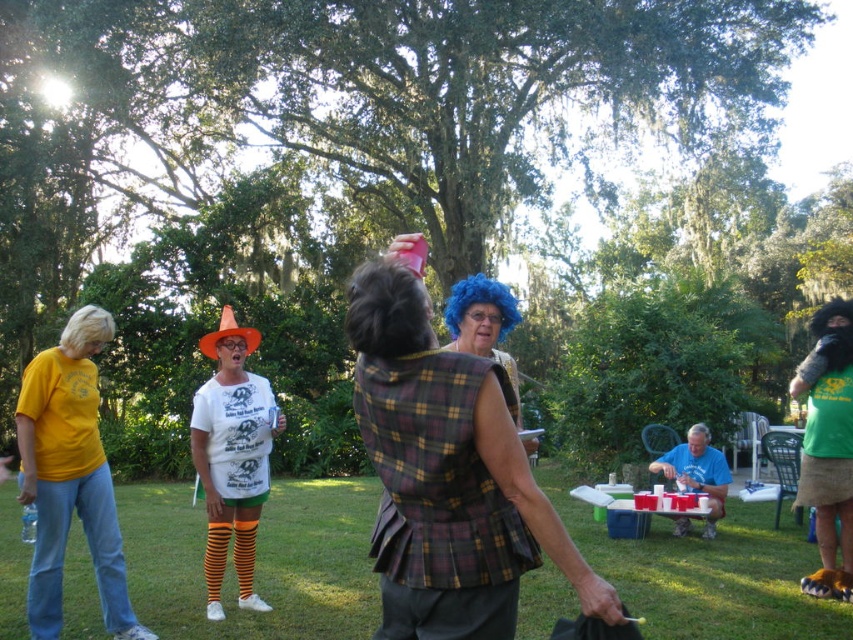
Question: Which point is farther to the camera?

Choices:
 (A) blue synthetic wig at center
 (B) orange striped tights at center
 (C) plaid fabric vest at center

Answer: (B)

Question: Which point is closer to the camera?

Choices:
 (A) (437, 451)
 (B) (386, 326)
 (C) (244, 442)

Answer: (B)

Question: Is blue plaid vest at center smaller than blonde synthetic wig at upper left?

Choices:
 (A) yes
 (B) no

Answer: (A)

Question: Does blue synthetic wig at center have a lesser width compared to blonde synthetic wig at upper left?

Choices:
 (A) no
 (B) yes

Answer: (B)

Question: Can you confirm if plaid fabric vest at center is wider than orange striped tights at center?

Choices:
 (A) no
 (B) yes

Answer: (B)

Question: Which object is farther from the camera taking this photo?

Choices:
 (A) blue plaid vest at center
 (B) blue synthetic wig at center
 (C) blonde synthetic wig at upper left
 (D) plaid fabric vest at center

Answer: (A)